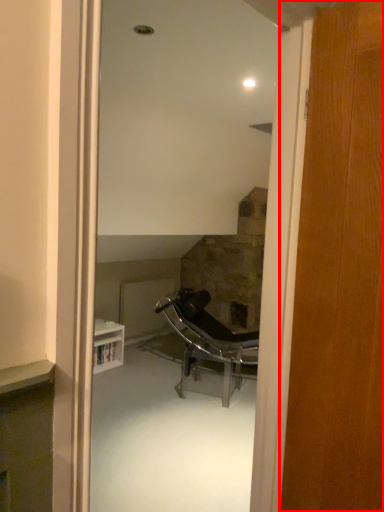
Question: From the image's perspective, considering the relative positions of door (annotated by the red box) and chair in the image provided, where is door (annotated by the red box) located with respect to the staircase?

Choices:
 (A) above
 (B) below

Answer: (A)